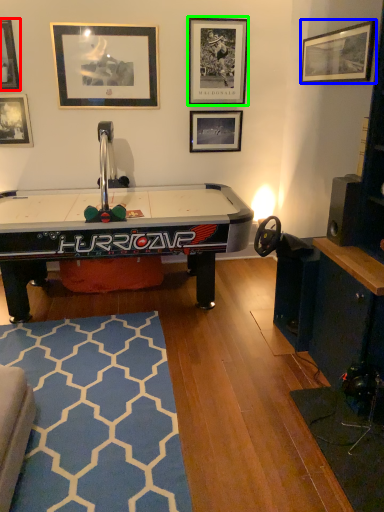
Question: Which is nearer to the picture frame (highlighted by a red box)? picture frame (highlighted by a blue box) or picture frame (highlighted by a green box).

Choices:
 (A) picture frame
 (B) picture frame

Answer: (B)